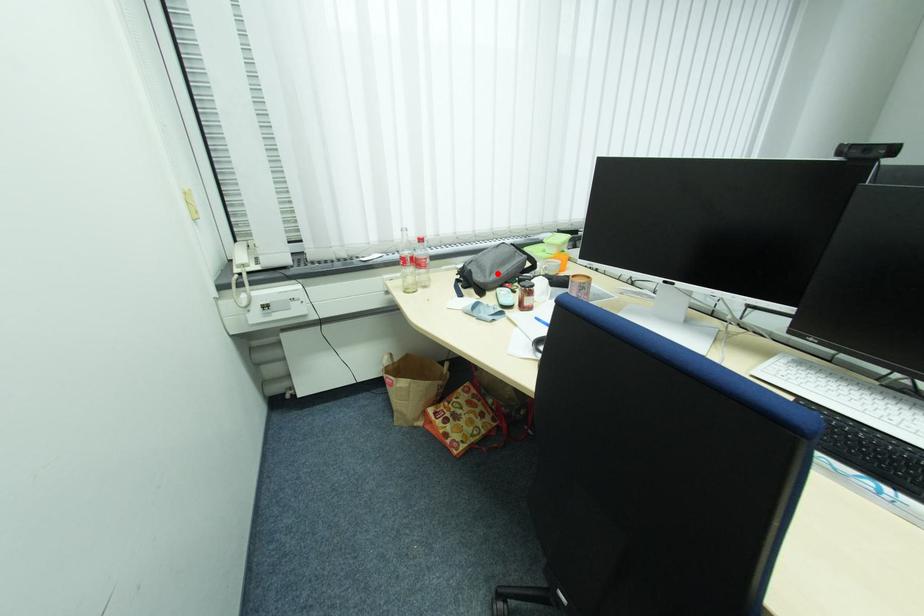
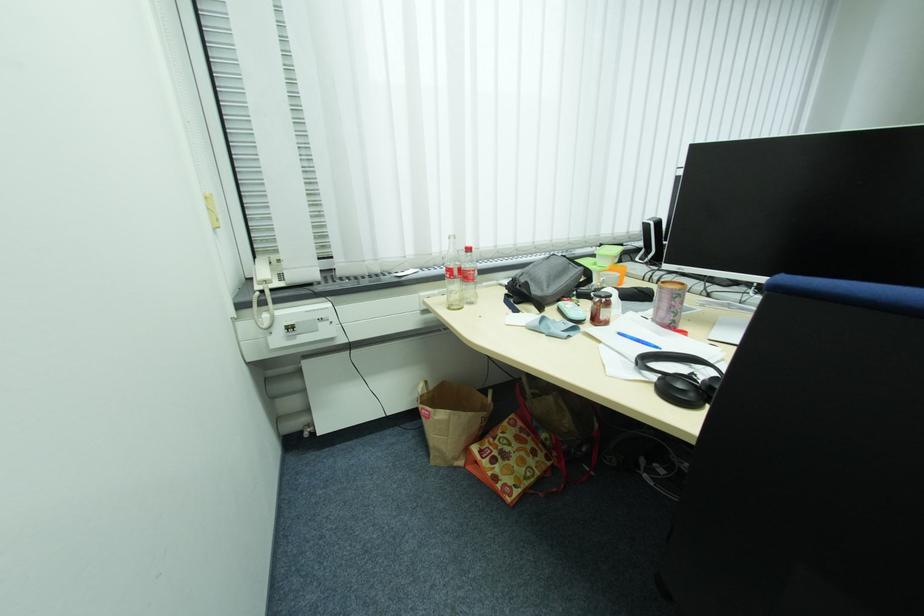
Where in the second image is the point corresponding to the highlighted location from the first image?

(554, 286)